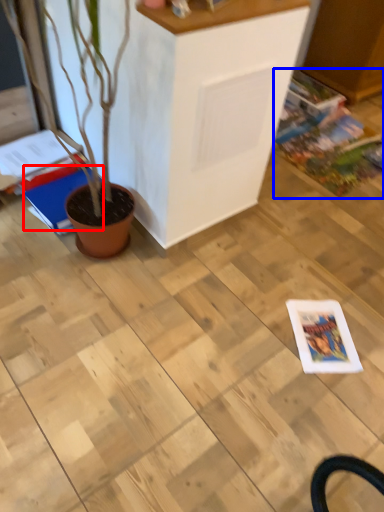
Question: Which of the following is the farthest to the observer, magazine (highlighted by a red box) or comic book (highlighted by a blue box)?

Choices:
 (A) magazine
 (B) comic book

Answer: (B)